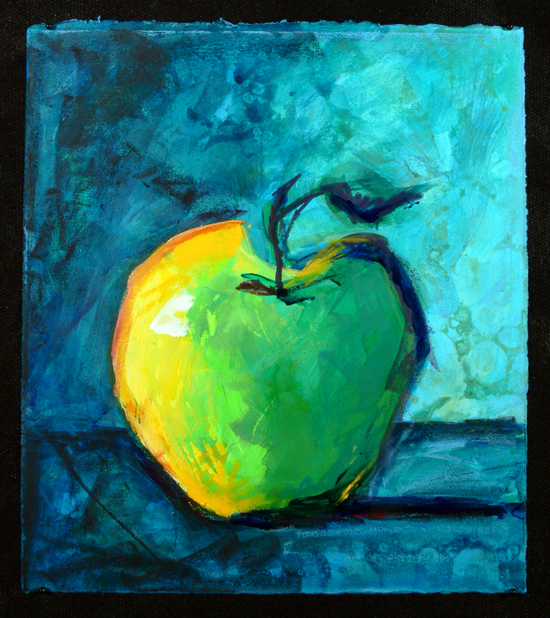
This screenshot has width=550, height=618. What are the coordinates of `floor` in the screenshot? It's located at [x=432, y=491].